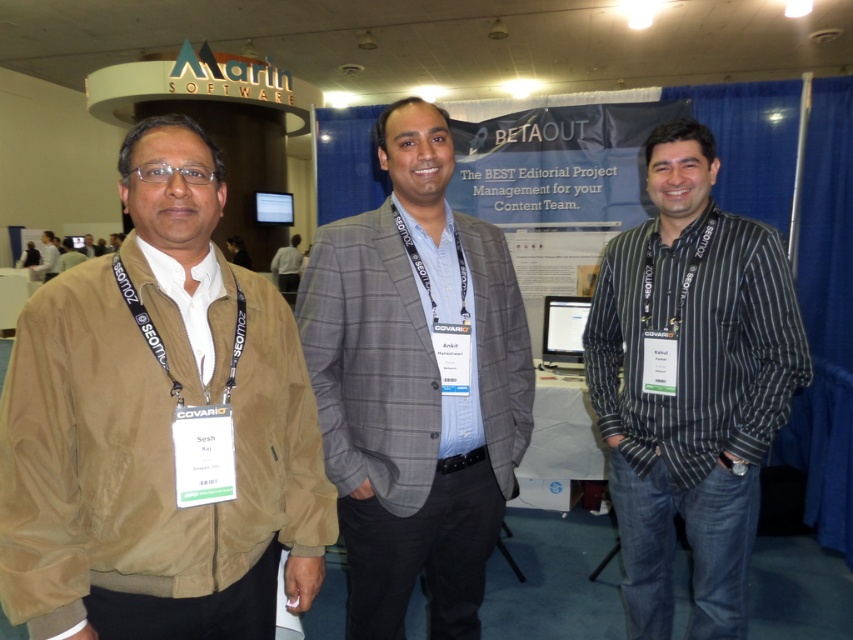
Question: Does black striped shirt at center appear over white shirt at center?

Choices:
 (A) no
 (B) yes

Answer: (A)

Question: Which point is farther from the camera taking this photo?

Choices:
 (A) (293, 305)
 (B) (82, 412)
 (C) (650, 230)
 (D) (422, 300)

Answer: (A)

Question: Is black striped shirt at center to the right of white shirt at center from the viewer's perspective?

Choices:
 (A) yes
 (B) no

Answer: (A)

Question: Estimate the real-world distances between objects in this image. Which object is closer to the white shirt at center?

Choices:
 (A) brown leather jacket at left
 (B) black striped shirt at center
 (C) tan suede jacket at left

Answer: (A)

Question: Can you confirm if gray plaid blazer at center is bigger than brown leather jacket at left?

Choices:
 (A) yes
 (B) no

Answer: (B)

Question: Which of the following is the farthest from the observer?

Choices:
 (A) white shirt at center
 (B) black striped shirt at center
 (C) brown leather jacket at left

Answer: (C)